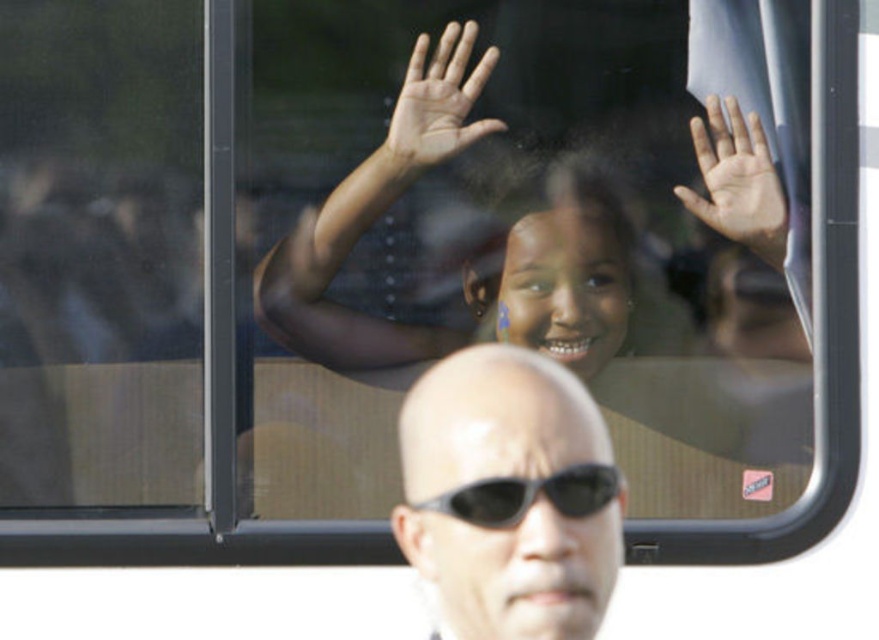
Question: Which of the following is the closest to the observer?

Choices:
 (A) (462, 396)
 (B) (467, 342)
 (C) (473, 93)

Answer: (A)

Question: Which point is closer to the camera?

Choices:
 (A) (571, 504)
 (B) (702, 124)

Answer: (A)

Question: Where is matte black girl at center located in relation to light brown skin at upper center in the image?

Choices:
 (A) left
 (B) right

Answer: (B)

Question: Among these points, which one is nearest to the camera?

Choices:
 (A) (474, 125)
 (B) (514, 604)
 (C) (354, 176)

Answer: (B)

Question: Can you confirm if light brown skin at upper center is positioned above black plastic goggles at upper center?

Choices:
 (A) no
 (B) yes

Answer: (B)

Question: Considering the relative positions of matte black girl at center and black plastic goggles at upper center in the image provided, where is matte black girl at center located with respect to black plastic goggles at upper center?

Choices:
 (A) above
 (B) below

Answer: (A)